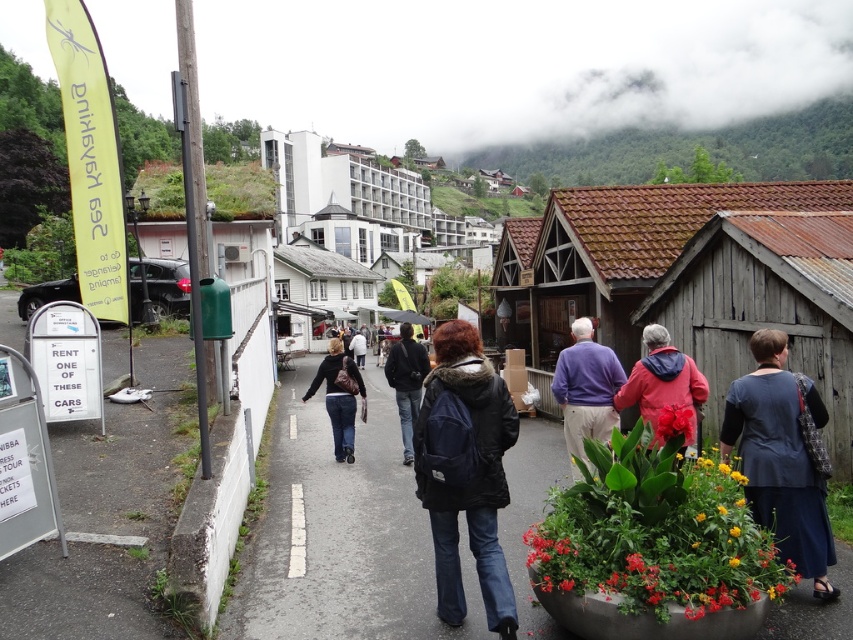
Question: Which point is farther from the camera taking this photo?

Choices:
 (A) (496, 476)
 (B) (358, 333)

Answer: (B)

Question: Which object appears farthest from the camera in this image?

Choices:
 (A) green grassy hillside at upper center
 (B) dark blue fabric dress at lower right

Answer: (A)

Question: Can you confirm if purple sweater at center is positioned to the right of matte black jacket at center?

Choices:
 (A) yes
 (B) no

Answer: (A)

Question: Which point appears farthest from the camera in this image?

Choices:
 (A) (294, 428)
 (B) (732, 531)
 (C) (815, 556)

Answer: (A)

Question: Does red matte flower pot at lower right lie behind dark blue backpack at center?

Choices:
 (A) yes
 (B) no

Answer: (B)

Question: Is smooth concrete pavement at center positioned behind dark blue jacket at center?

Choices:
 (A) no
 (B) yes

Answer: (A)